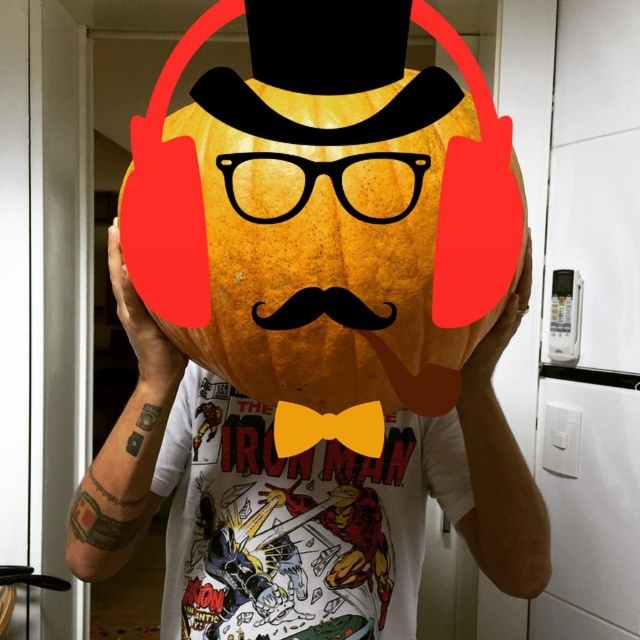
Question: Which of the following is the farthest from the observer?

Choices:
 (A) yellow fabric bow tie at center
 (B) orange matte pumpkin at center

Answer: (A)

Question: Does orange matte pumpkin at center have a smaller size compared to yellow fabric bow tie at center?

Choices:
 (A) no
 (B) yes

Answer: (A)

Question: Can you confirm if orange matte pumpkin at center is positioned to the right of yellow fabric bow tie at center?

Choices:
 (A) yes
 (B) no

Answer: (B)

Question: Does orange matte pumpkin at center come behind yellow fabric bow tie at center?

Choices:
 (A) yes
 (B) no

Answer: (B)